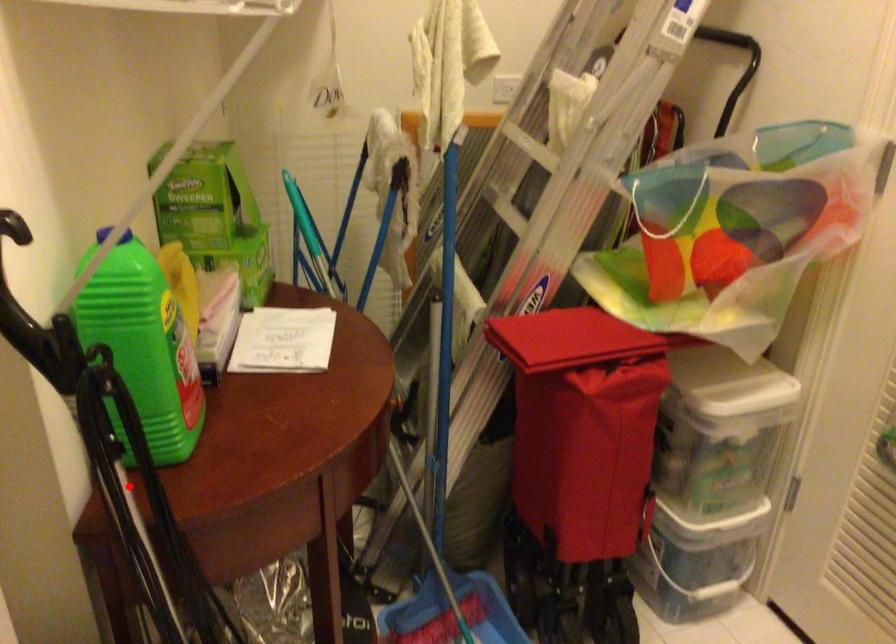
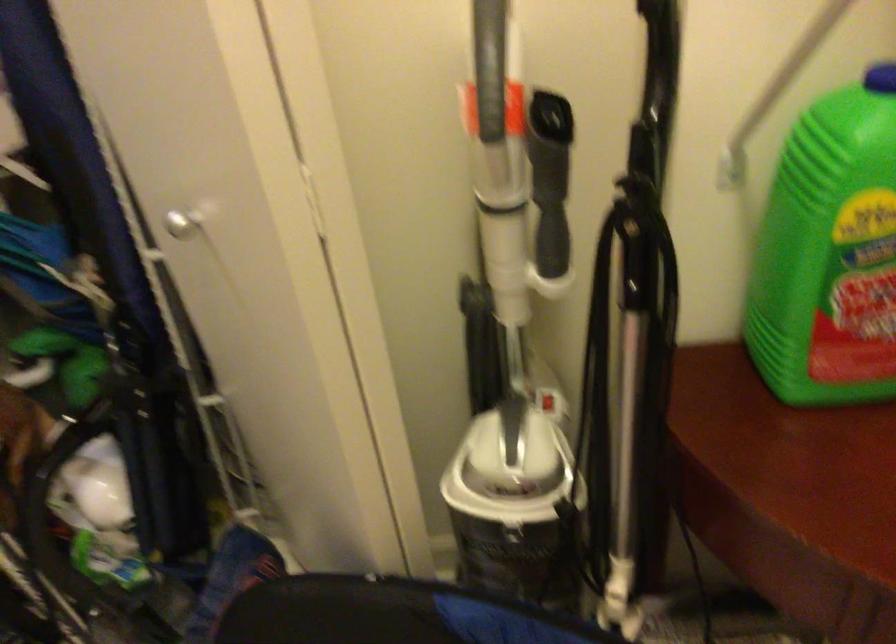
Question: A red point is marked in image1. In image2, is the corresponding 3D point closer to the camera or farther? Reply with the corresponding letter.

Choices:
 (A) The corresponding 3D point is closer.
 (B) The corresponding 3D point is farther.

Answer: (A)